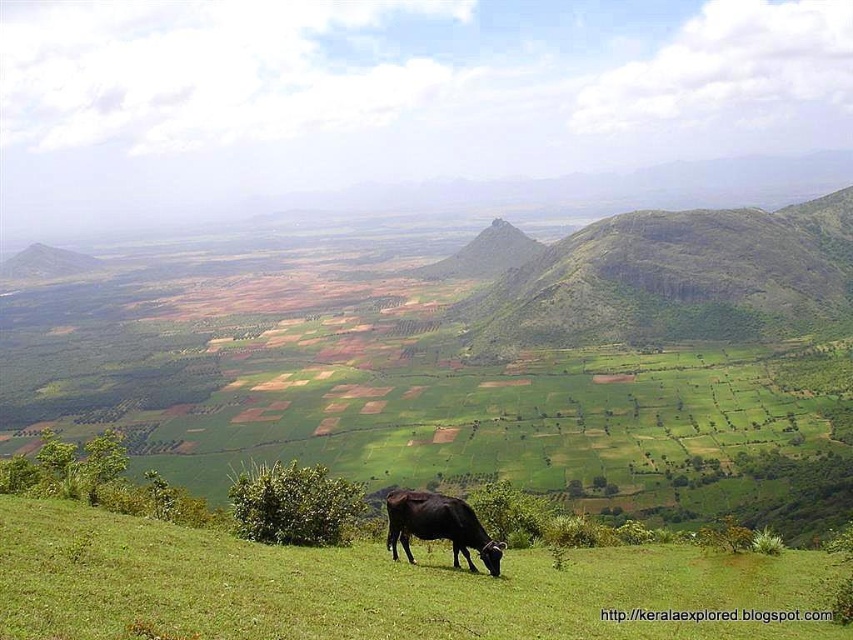
Question: Is green grassy hill at upper center bigger than black glossy cow at lower center?

Choices:
 (A) no
 (B) yes

Answer: (B)

Question: Estimate the real-world distances between objects in this image. Which object is farther from the green grassy field at lower center?

Choices:
 (A) green grassy hill at upper center
 (B) black glossy cow at lower center

Answer: (A)

Question: Is green grassy hill at upper center positioned in front of black glossy cow at lower center?

Choices:
 (A) yes
 (B) no

Answer: (B)

Question: Where is green grassy field at lower center located in relation to black glossy cow at lower center in the image?

Choices:
 (A) left
 (B) right

Answer: (B)

Question: Which object is farther from the camera taking this photo?

Choices:
 (A) black glossy cow at lower center
 (B) green grassy hill at upper center

Answer: (B)

Question: Which is farther from the green grassy hill at upper center?

Choices:
 (A) green grassy field at lower center
 (B) black glossy cow at lower center

Answer: (B)